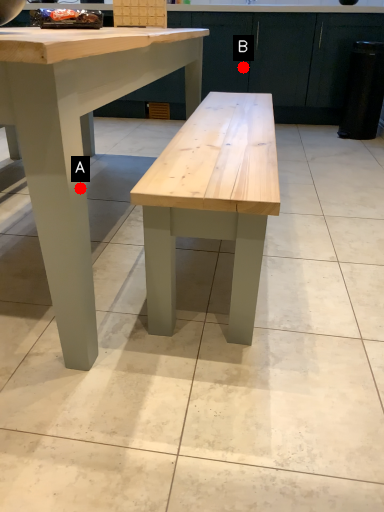
Question: Two points are circled on the image, labeled by A and B beside each circle. Which point is further to the camera?

Choices:
 (A) A is further
 (B) B is further

Answer: (B)